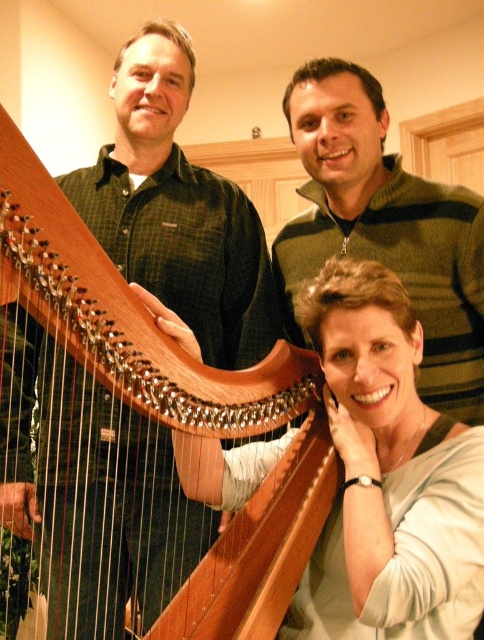
Question: Does matte white shirt at center have a lesser width compared to green striped sweater at upper right?

Choices:
 (A) no
 (B) yes

Answer: (B)

Question: Among these objects, which one is nearest to the camera?

Choices:
 (A) matte white shirt at center
 (B) wooden harp at center

Answer: (B)

Question: In this image, where is matte white shirt at center located relative to wooden harp at center?

Choices:
 (A) right
 (B) left

Answer: (A)

Question: Estimate the real-world distances between objects in this image. Which object is closer to the green striped sweater at upper right?

Choices:
 (A) matte white shirt at center
 (B) wooden harp at center

Answer: (A)

Question: Which object appears farthest from the camera in this image?

Choices:
 (A) matte white shirt at center
 (B) green striped sweater at upper right

Answer: (B)

Question: Can you confirm if matte white shirt at center is bigger than green striped sweater at upper right?

Choices:
 (A) no
 (B) yes

Answer: (A)